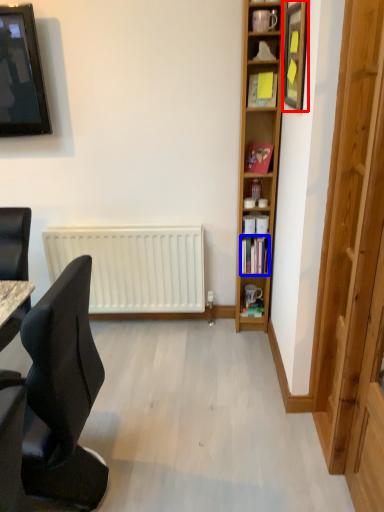
Question: Among these objects, which one is farthest to the camera, picture frame (highlighted by a red box) or book (highlighted by a blue box)?

Choices:
 (A) picture frame
 (B) book

Answer: (B)